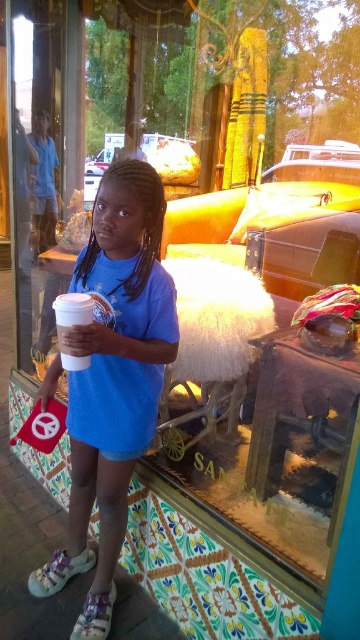
You are a photographer trying to capture a clear shot of the blue matte shirt at center and the white paper cup at center. Since you want both items in focus, you need to know their positions relative to each other. Which object is positioned to the right side?

The blue matte shirt at center is to the right of the white paper cup at center.

The young girl is holding a white paper cup at center in her right hand and wearing a blue matte shirt at center. Which object is taller?

The blue matte shirt at center is much taller than the white paper cup at center.

You are a photographer trying to capture the girl holding the blue matte shirt at center and the white paper cup at center. Which object should you focus on first to ensure it appears sharp in the photo?

The blue matte shirt at center is closer to the viewer than the white paper cup at center, so you should focus on the blue matte shirt at center first to ensure it appears sharp.